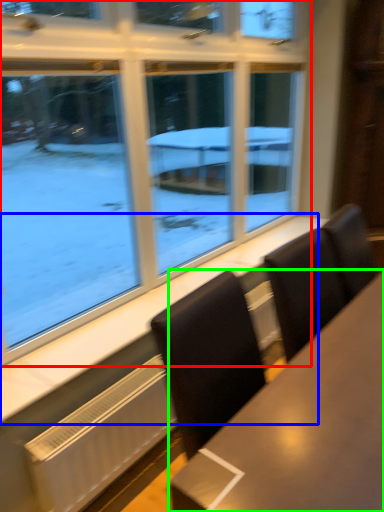
Question: Which object is positioned farthest from window (highlighted by a red box)? Select from window sill (highlighted by a blue box) and table (highlighted by a green box).

Choices:
 (A) window sill
 (B) table

Answer: (B)